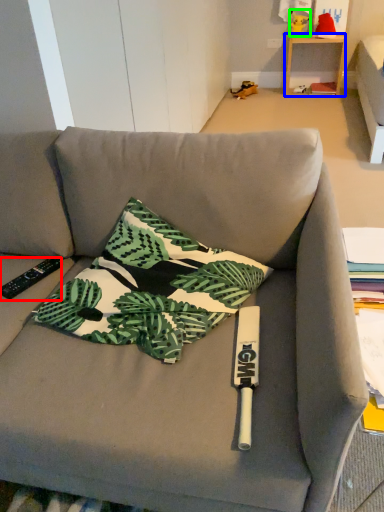
Question: Which object is positioned farthest from remote control (highlighted by a red box)? Select from table (highlighted by a blue box) and toy (highlighted by a green box).

Choices:
 (A) table
 (B) toy

Answer: (B)